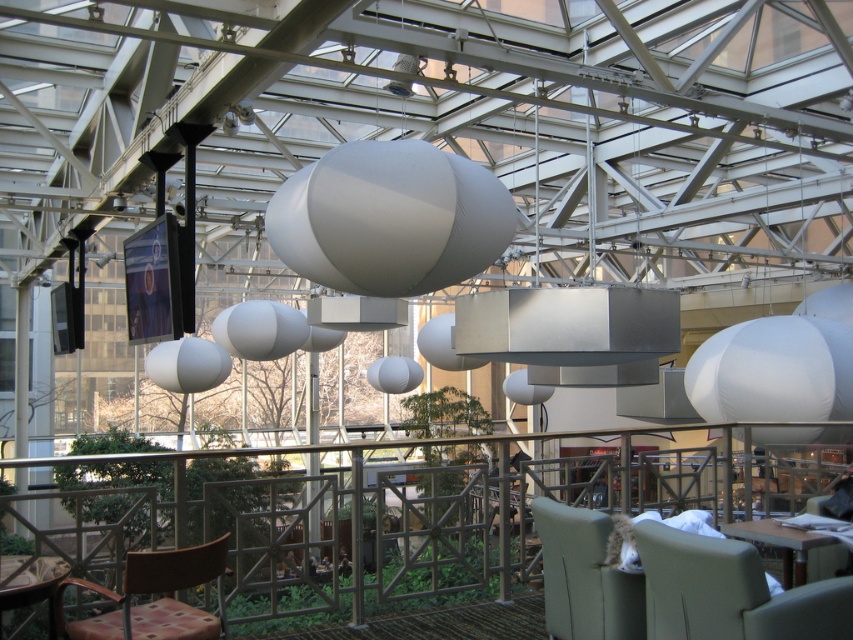
Find the location of a particular element. Image resolution: width=853 pixels, height=640 pixels. gray fabric chair at lower right is located at coordinates (730, 593).

Does gray fabric chair at lower right have a lesser width compared to gray fabric armchair at lower right?

No.

Does point (657, 524) lie behind point (613, 576)?

No, (657, 524) is closer to viewer.

This screenshot has height=640, width=853. Find the location of `gray fabric chair at lower right`. gray fabric chair at lower right is located at coordinates (730, 593).

Can you confirm if gray fabric armchair at lower right is thinner than matte white table at lower right?

Yes, gray fabric armchair at lower right is thinner than matte white table at lower right.

Between gray fabric armchair at lower right and matte white table at lower right, which one appears on the right side from the viewer's perspective?

Positioned to the right is matte white table at lower right.

Find the location of a particular element. gray fabric armchair at lower right is located at coordinates (585, 577).

Does gray fabric armchair at lower right come in front of plaid fabric armchair at lower left?

No, gray fabric armchair at lower right is further to the viewer.

Does gray fabric armchair at lower right have a larger size compared to plaid fabric armchair at lower left?

No, gray fabric armchair at lower right is not bigger than plaid fabric armchair at lower left.

Between point (585, 621) and point (90, 637), which one is positioned behind?

Positioned behind is point (585, 621).

This screenshot has height=640, width=853. Identify the location of gray fabric armchair at lower right. (585, 577).